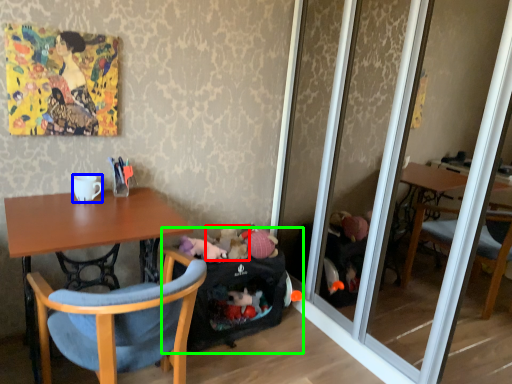
Question: Which object is the farthest from toy (highlighted by a red box)? Choose among these: coffee cup (highlighted by a blue box) or baby carriage (highlighted by a green box).

Choices:
 (A) coffee cup
 (B) baby carriage

Answer: (A)